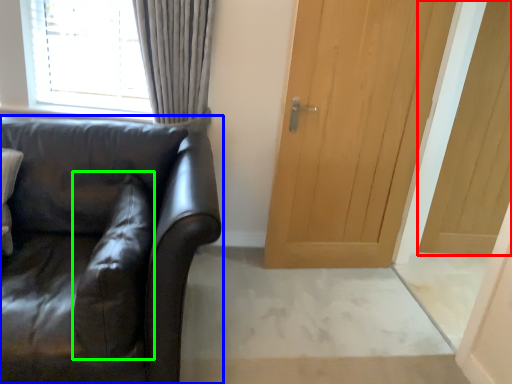
Question: Estimate the real-world distances between objects in this image. Which object is closer to door (highlighted by a red box), studio couch (highlighted by a blue box) or pillow (highlighted by a green box)?

Choices:
 (A) studio couch
 (B) pillow

Answer: (A)